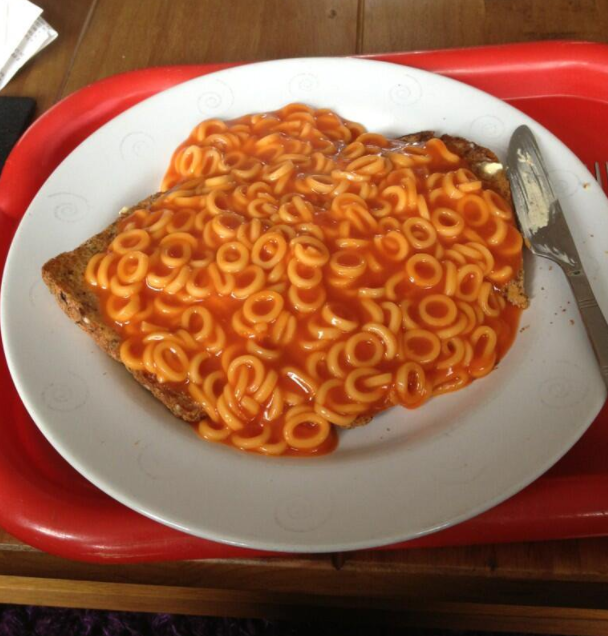
Identify the location of brown table top. (163, 25).